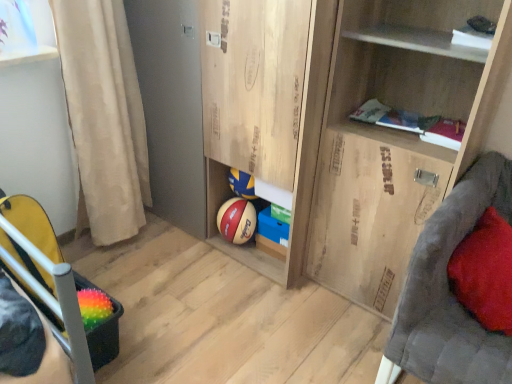
Question: Is point (102, 34) positioned closer to the camera than point (320, 11)?

Choices:
 (A) closer
 (B) farther

Answer: (B)

Question: In terms of width, does beige fabric curtain at left look wider or thinner when compared to wooden cupboard at upper right?

Choices:
 (A) thin
 (B) wide

Answer: (A)

Question: Considering the real-world distances, which object is farthest from the wooden cupboard at upper right?

Choices:
 (A) beige fabric curtain at left
 (B) wooden cabinet at lower center
 (C) rubber textured basketball at lower left
 (D) red velvet pillow at right

Answer: (C)

Question: Which is nearer to the beige fabric curtain at left?

Choices:
 (A) wooden cabinet at lower center
 (B) wooden cupboard at upper right
 (C) red velvet pillow at right
 (D) rubber textured basketball at lower left

Answer: (A)